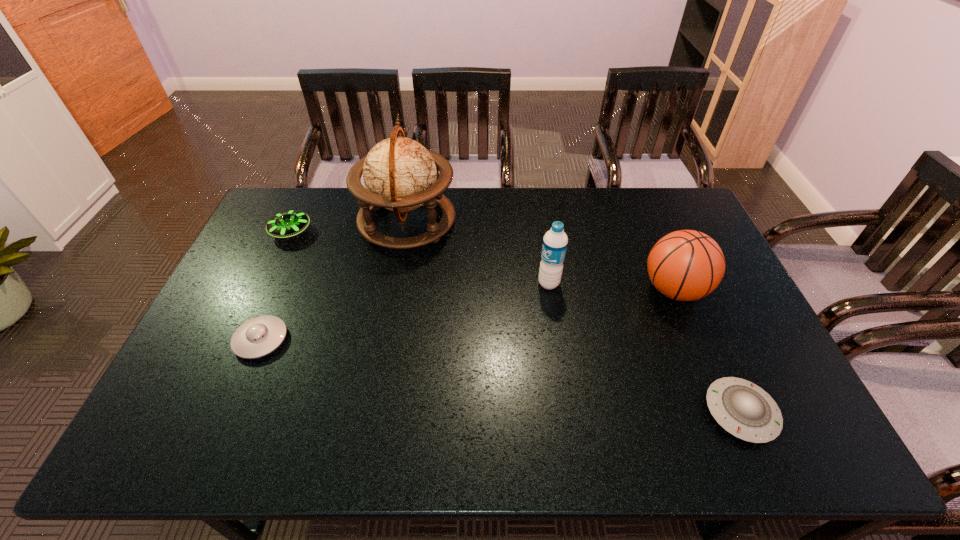
Image resolution: width=960 pixels, height=540 pixels. I want to click on basketball situated at the right edge, so click(x=685, y=265).

At what (x,y) coordinates should I click in order to perform the action: click on saucer present at the right edge. Please return your answer as a coordinate pair (x, y). This screenshot has width=960, height=540. Looking at the image, I should click on (745, 410).

Where is `object present at the far left corner`? The height and width of the screenshot is (540, 960). object present at the far left corner is located at coordinates [x=286, y=224].

Find the location of a particular element. object situated at the near right corner is located at coordinates (745, 410).

Identify the location of vacant space at the far edge of the desktop. (558, 195).

In the image, there is a desktop. Where is `vacant space at the left edge`? This screenshot has height=540, width=960. vacant space at the left edge is located at coordinates (266, 237).

Locate an element on the screen. vacant space at the right edge of the desktop is located at coordinates (786, 395).

Locate an element on the screen. The width and height of the screenshot is (960, 540). unoccupied position between the water bottle and the second nearest saucer is located at coordinates (405, 312).

You are a GUI agent. You are given a task and a screenshot of the screen. Output one action in this format:
    pyautogui.click(x=<x>, y=<y>)
    Task: Click on the free space between the fifth farthest object and the basketball
    The width and height of the screenshot is (960, 540).
    Given the screenshot: What is the action you would take?
    pyautogui.click(x=468, y=315)

Identify the location of empty location between the water bottle and the fifth farthest object. (405, 312).